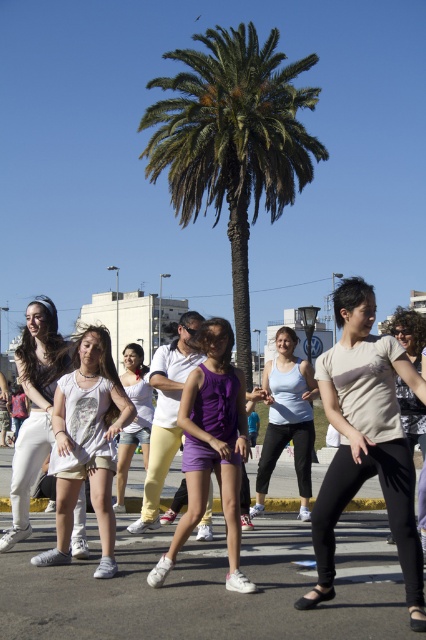
Question: Which object is farther from the camera taking this photo?

Choices:
 (A) white matte tank top at center
 (B) green leafy palm at center

Answer: (B)

Question: Can you confirm if purple matte shorts at center is thinner than matte white shirt at center?

Choices:
 (A) no
 (B) yes

Answer: (B)

Question: Which point appears closest to the camera in this image?

Choices:
 (A) (416, 403)
 (B) (14, 502)

Answer: (B)

Question: Is green leafy palm at center thinner than matte beige shirt at center?

Choices:
 (A) yes
 (B) no

Answer: (B)

Question: In this image, where is purple matte shorts at center located relative to matte white shirt at center?

Choices:
 (A) right
 (B) left

Answer: (B)

Question: Which object is closer to the camera taking this photo?

Choices:
 (A) green leafy palm at center
 (B) purple matte shorts at center

Answer: (B)